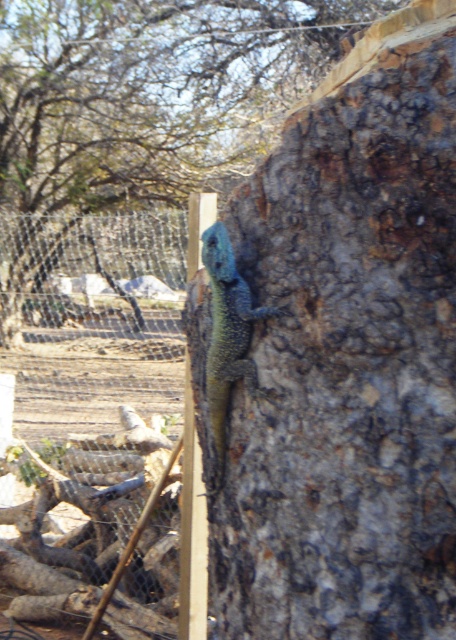
You are a zookeeper who needs to place a new feeding station between the smooth bark tree trunk at center and the wire mesh fence at left. The feeding station requires a minimum of 10 feet of space to be safely placed. Based on the scene, can you safely install the feeding station in this area?

The smooth bark tree trunk at center is 8.76 feet from the wire mesh fence at left. Since the required space for the feeding station is 10 feet, the distance between them is insufficient. Therefore, the feeding station cannot be safely installed in this area.